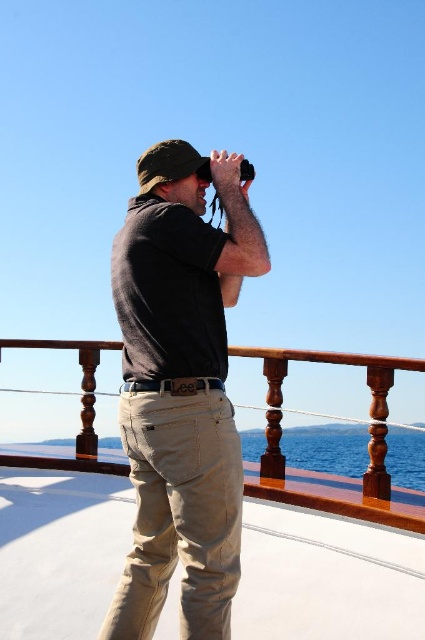
Measure the distance between dark gray cotton shirt at center and wooden at center.

They are 6.92 feet apart.

Which is behind, point (212, 609) or point (385, 381)?

Point (385, 381)

Find the location of `dark gray cotton shirt at center`. dark gray cotton shirt at center is located at coordinates (181, 388).